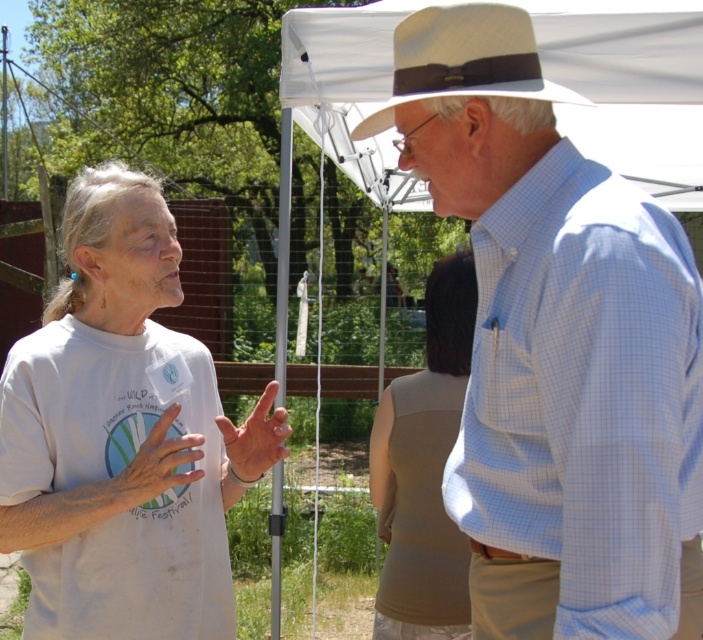
Is light blue checkered shirt at center taller than beige fabric tank top at center?

No.

Describe the element at coordinates (557, 348) in the screenshot. I see `light blue checkered shirt at center` at that location.

Between point (695, 592) and point (380, 529), which one is positioned in front?

Point (695, 592) is in front.

Find the location of a particular element. Image resolution: width=703 pixels, height=640 pixels. light blue checkered shirt at center is located at coordinates click(557, 348).

Does light blue checkered shirt at center have a lesser width compared to beige straw hat at upper center?

In fact, light blue checkered shirt at center might be wider than beige straw hat at upper center.

Is light blue checkered shirt at center wider than beige straw hat at upper center?

Correct, the width of light blue checkered shirt at center exceeds that of beige straw hat at upper center.

Does point (534, 586) come behind point (463, 38)?

Yes, it is.

Locate an element on the screen. light blue checkered shirt at center is located at coordinates (557, 348).

Identify the location of white fabric canopy at upper center. Image resolution: width=703 pixels, height=640 pixels. (631, 86).

Who is positioned more to the right, white fabric canopy at upper center or beige fabric tank top at center?

white fabric canopy at upper center

Identify the location of white fabric canopy at upper center. tap(631, 86).